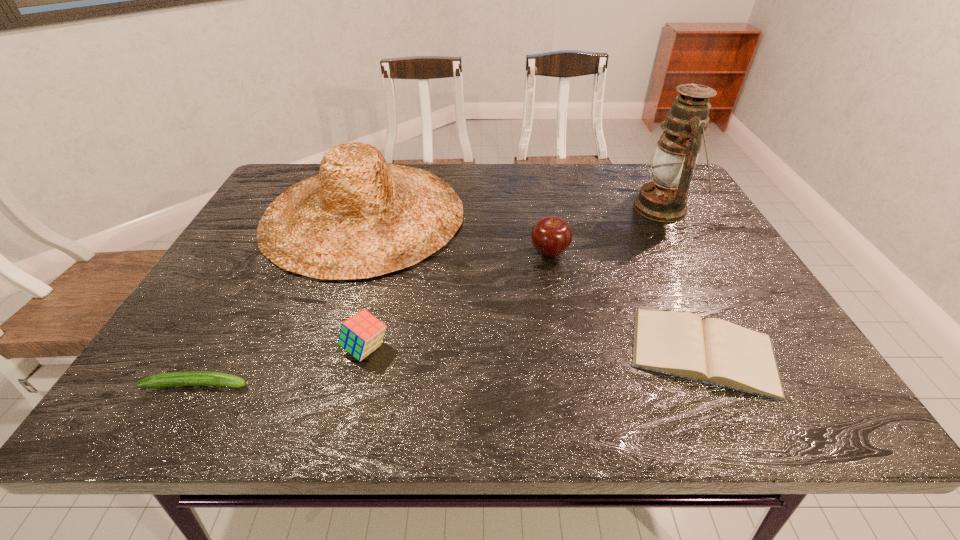
Locate an element on the screen. This screenshot has width=960, height=540. unoccupied area between the Bible and the cube is located at coordinates pyautogui.click(x=535, y=350).

Locate an element on the screen. free spot between the tallest object and the zucchini is located at coordinates (430, 296).

The height and width of the screenshot is (540, 960). I want to click on vacant region between the tallest object and the third tallest object, so click(606, 230).

At what (x,y) coordinates should I click in order to perform the action: click on free point between the apple and the second tallest object. Please return your answer as a coordinate pair (x, y). The height and width of the screenshot is (540, 960). Looking at the image, I should click on (456, 233).

At what (x,y) coordinates should I click in order to perform the action: click on vacant point located between the fifth shortest object and the fourth shortest object. Please return your answer as a coordinate pair (x, y). Looking at the image, I should click on (456, 233).

I want to click on free spot between the sunhat and the tallest object, so click(514, 212).

Where is `free space between the lantern and the fifth shortest object`? Image resolution: width=960 pixels, height=540 pixels. free space between the lantern and the fifth shortest object is located at coordinates (514, 212).

This screenshot has width=960, height=540. What are the coordinates of `free area in between the fourth shortest object and the third shortest object` in the screenshot? It's located at (457, 300).

You are a GUI agent. You are given a task and a screenshot of the screen. Output one action in this format:
    pyautogui.click(x=<x>, y=<y>)
    Task: Click on the free space between the lantern and the Bible
    Image resolution: width=960 pixels, height=540 pixels.
    Given the screenshot: What is the action you would take?
    pyautogui.click(x=683, y=280)

At what (x,y) coordinates should I click in order to perform the action: click on blank region between the zucchini and the cube. Please return your answer as a coordinate pair (x, y). This screenshot has height=540, width=960. Looking at the image, I should click on (281, 367).